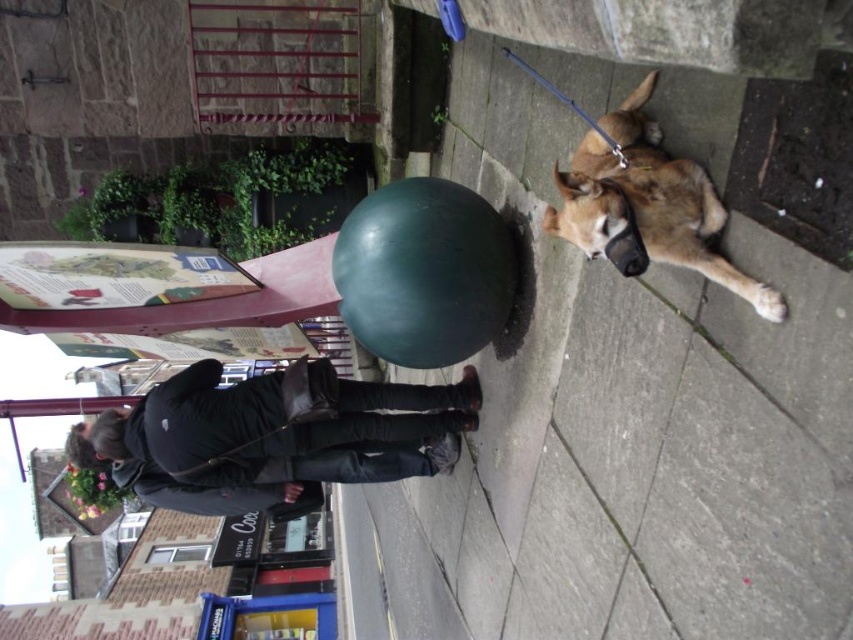
Which is below, dark gray leather jacket at center or brown fur dog at right?

dark gray leather jacket at center

At what (x,y) coordinates should I click in order to perform the action: click on dark gray leather jacket at center. Please return your answer as a coordinate pair (x, y). Looking at the image, I should click on (283, 432).

Find the location of `dark gray leather jacket at center`. dark gray leather jacket at center is located at coordinates (283, 432).